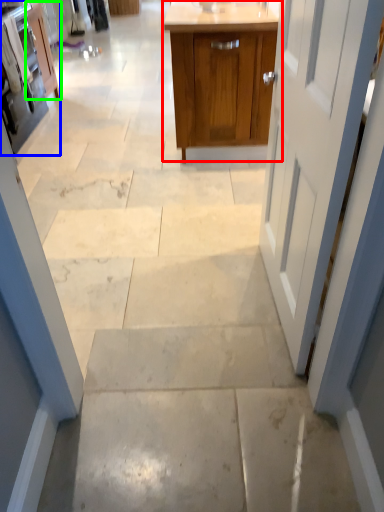
Question: Considering the real-world distances, which object is farthest from cabinetry (highlighted by a red box)? cabinetry (highlighted by a blue box) or cabinetry (highlighted by a green box)?

Choices:
 (A) cabinetry
 (B) cabinetry

Answer: (B)